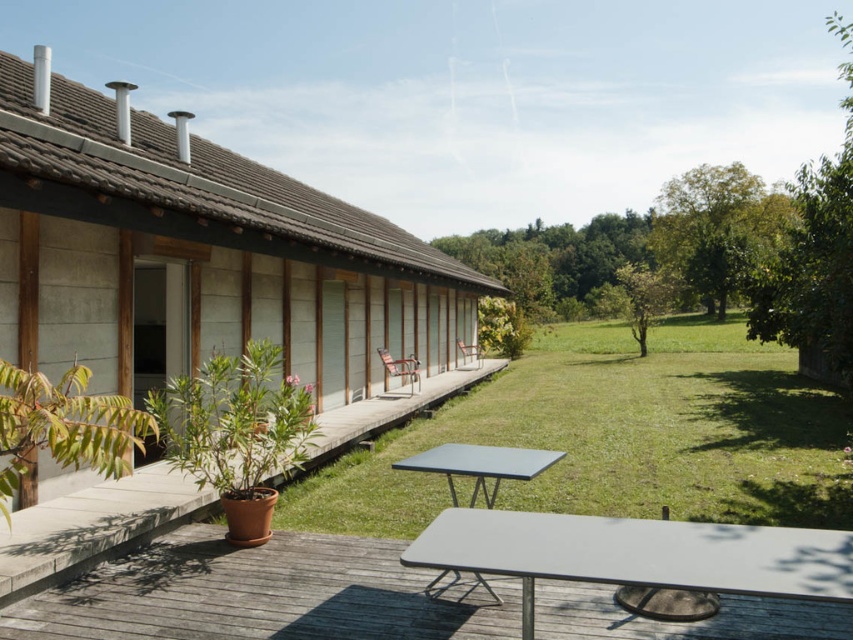
You are standing at the entrance of the building and want to find the matte concrete terrace at left. Based on the coordinates provided, in which direction should you walk from your current position to locate it?

The matte concrete terrace at left is located at coordinates point (196,253), so you should walk towards the left side of the scene to find it.

You are planning to place a new bench that is 2 meters wide on the green grass lawn at center. Based on the scene, can the bench fit on the smooth gray table at lower center?

The smooth gray table at lower center is narrower than the green grass lawn at center. However, the bench is intended for the lawn, not the table. The question seems to mix up placement locations. Please clarify the intended location.

You are planning to set up a picnic on the green grass lawn at center. Considering the size of the smooth gray table at lower center, will there be enough space for your picnic blanket?

The green grass lawn at center has a larger size compared to the smooth gray table at lower center, so there should be enough space for your picnic blanket.